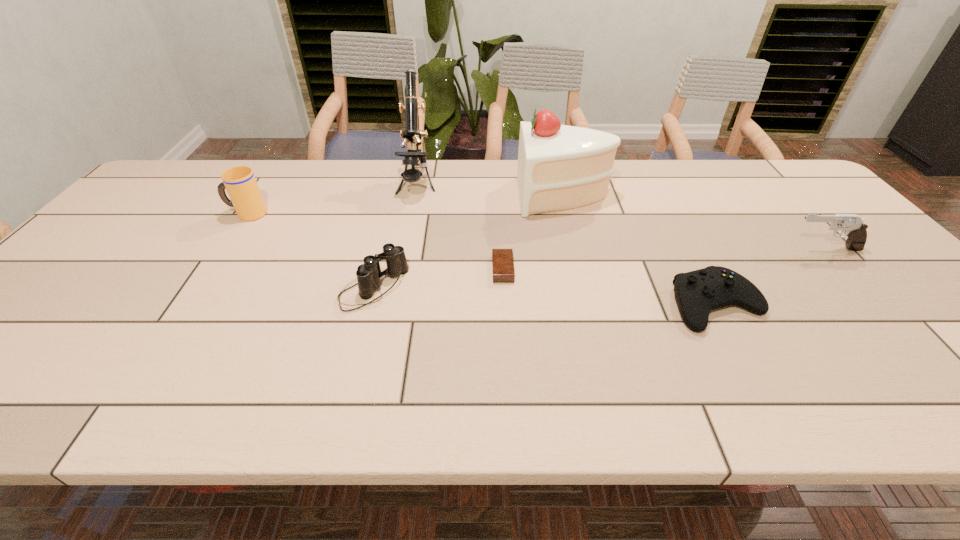
The height and width of the screenshot is (540, 960). Identify the location of free space located on the back of the fifth tallest object. (389, 228).

You are a GUI agent. You are given a task and a screenshot of the screen. Output one action in this format:
    pyautogui.click(x=<x>, y=<y>)
    Task: Click on the vacant space located 0.180m on the back of the second object from right to left
    The width and height of the screenshot is (960, 540).
    Given the screenshot: What is the action you would take?
    pyautogui.click(x=678, y=233)

Locate an element on the screen. The width and height of the screenshot is (960, 540). vacant space situated on the front face of the shortest object is located at coordinates (334, 269).

I want to click on free location located 0.260m on the front face of the shortest object, so click(x=390, y=269).

You are a GUI agent. You are given a task and a screenshot of the screen. Output one action in this format:
    pyautogui.click(x=<x>, y=<y>)
    Task: Click on the vacant area located on the front face of the shortest object
    This screenshot has width=960, height=540.
    Given the screenshot: What is the action you would take?
    (468, 269)

Where is `microscope situated at the far edge`? Image resolution: width=960 pixels, height=540 pixels. microscope situated at the far edge is located at coordinates (412, 134).

You are a GUI agent. You are given a task and a screenshot of the screen. Output one action in this format:
    pyautogui.click(x=<x>, y=<y>)
    Task: Click on the cake that is at the far edge
    This screenshot has height=540, width=960.
    Given the screenshot: What is the action you would take?
    pyautogui.click(x=560, y=167)

At what (x,y) coordinates should I click in order to perform the action: click on object located in the right edge section of the desktop. Please return your answer as a coordinate pair (x, y). The height and width of the screenshot is (540, 960). Looking at the image, I should click on (855, 229).

In the image, there is a desktop. Where is `vacant space at the far edge`? This screenshot has height=540, width=960. vacant space at the far edge is located at coordinates (762, 195).

Find the location of `free space at the near edge`. free space at the near edge is located at coordinates (228, 377).